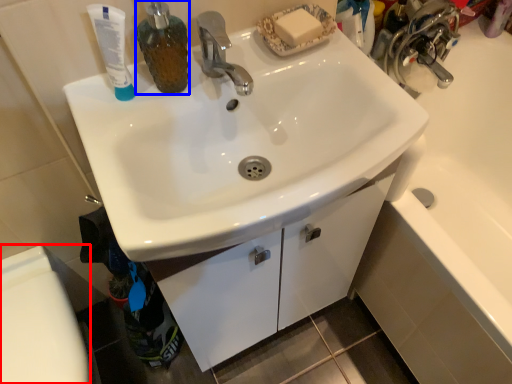
Question: Which object is closer to the camera taking this photo, toilet bowl (highlighted by a red box) or soap dispenser (highlighted by a blue box)?

Choices:
 (A) toilet bowl
 (B) soap dispenser

Answer: (B)